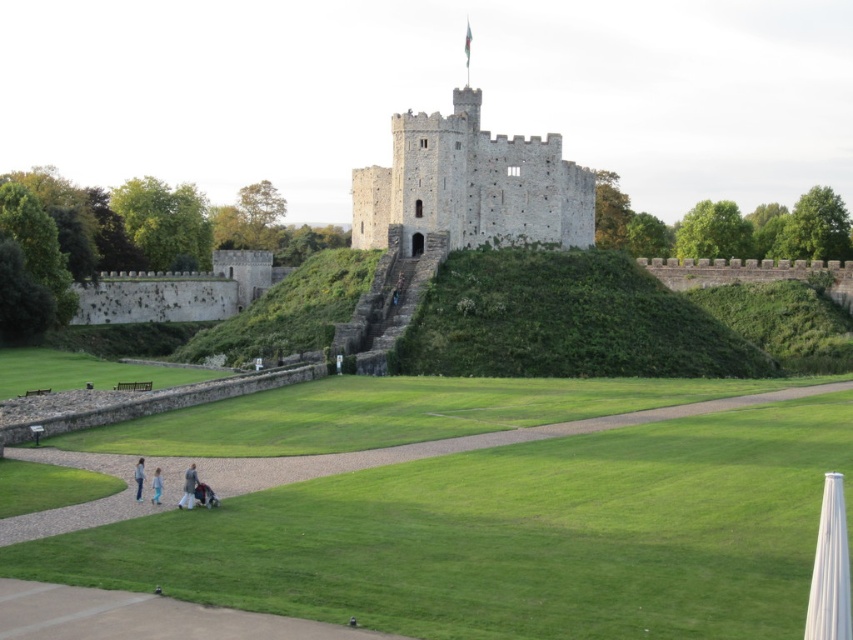
You are standing at the lower left corner of the castle grounds and see the stone tower at center and the light blue jeans at lower left. Which object is closer to your current position?

The light blue jeans at lower left is closer to your current position as you are standing at the lower left corner, and the stone tower at center is to the right of the light blue jeans at lower left, making it farther away.

You are standing at the base of the castle steps and want to reach the point marked at coordinates point (187, 497). Given that you can walk 100 feet in 2 minutes, how long will it take you to reach that point?

The point (187, 497) is 159.84 feet away from you. At a walking pace of 100 feet per 2 minutes, it would take approximately 3.1968 minutes to reach the point. Rounded to the nearest whole number, this is about 3 minutes.

Looking at this image, you are standing at the base of the castle steps and want to take a photo of the castle. The camera you are using has a maximum focus range of 300 feet. Is the point at coordinates point [410,179] within the camera focus range?

The distance of point [410,179] from the camera is 329.33 feet, which exceeds the camera focus range of 300 feet. Therefore, the point is out of focus range.